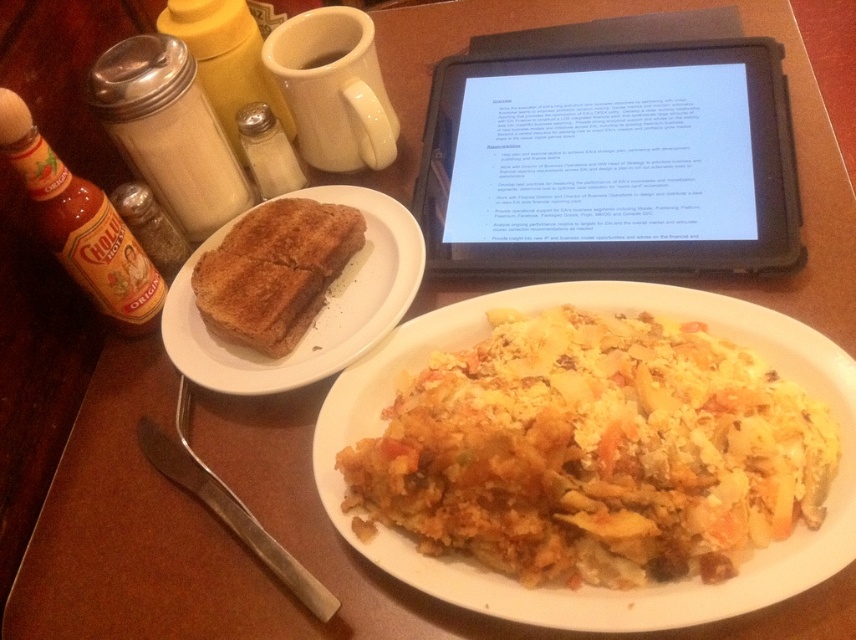
Question: Is yellow cheesy pasta at center positioned in front of black plastic tablet at upper center?

Choices:
 (A) yes
 (B) no

Answer: (A)

Question: Which point appears closest to the camera in this image?

Choices:
 (A) (758, 401)
 (B) (232, 358)

Answer: (A)

Question: Which point appears farthest from the camera in this image?

Choices:
 (A) (645, 212)
 (B) (384, 266)
 (C) (687, 560)

Answer: (B)

Question: Does yellow cheesy pasta at center appear on the right side of brown toasted bread at left?

Choices:
 (A) yes
 (B) no

Answer: (A)

Question: Is yellow cheesy pasta at center above black plastic tablet at upper center?

Choices:
 (A) no
 (B) yes

Answer: (A)

Question: Which object is farther from the camera taking this photo?

Choices:
 (A) yellow cheesy pasta at center
 (B) brown toasted bread at left

Answer: (B)